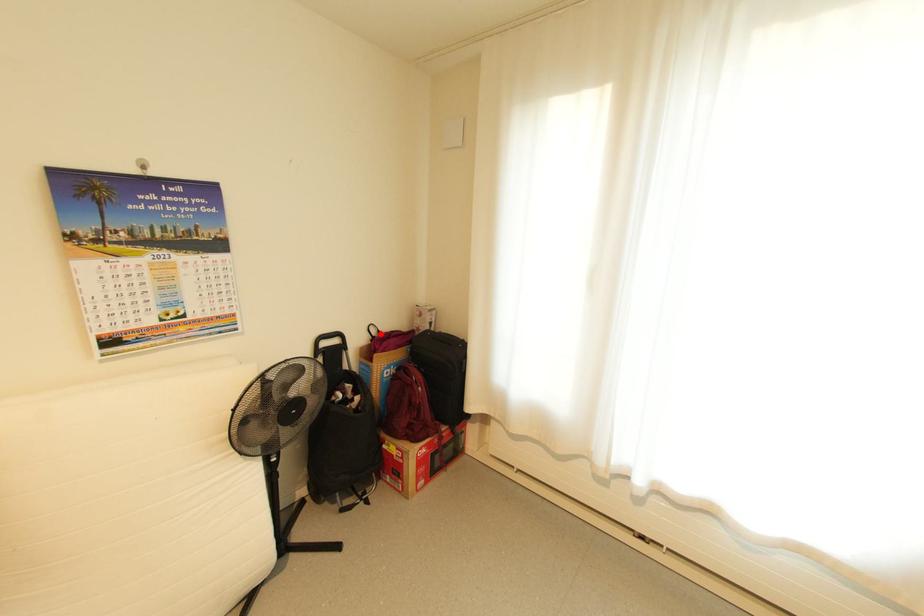
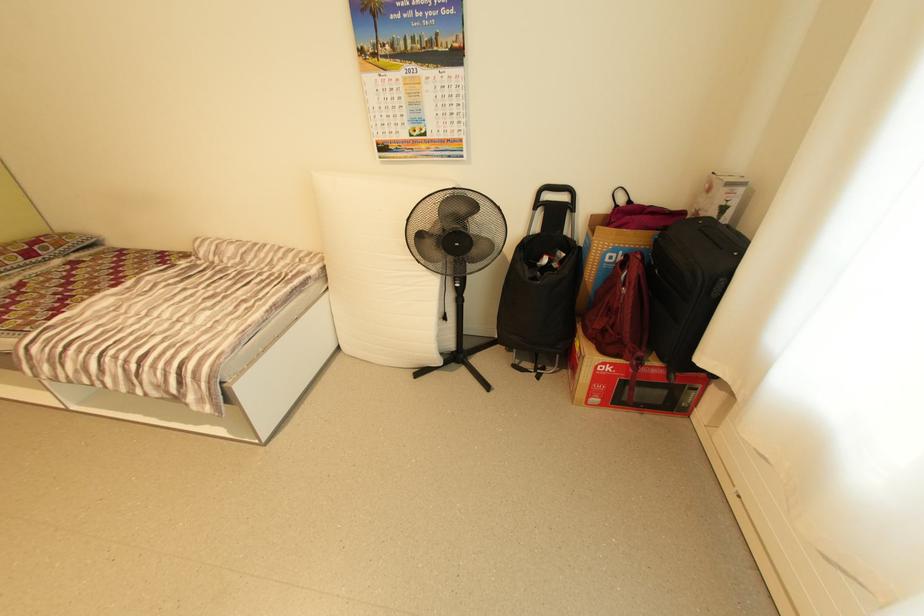
In the second image, find the point that corresponds to the highlighted location in the first image.

(628, 201)